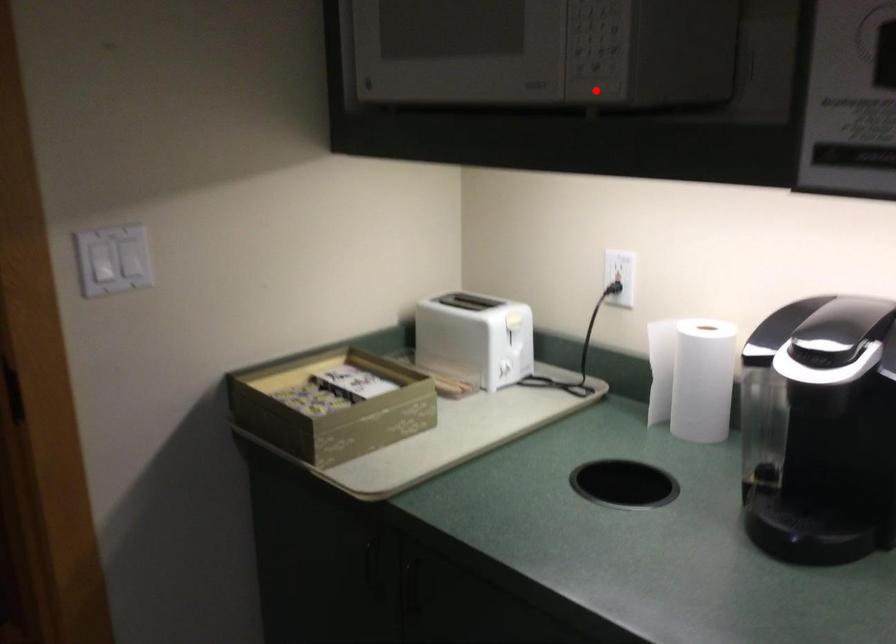
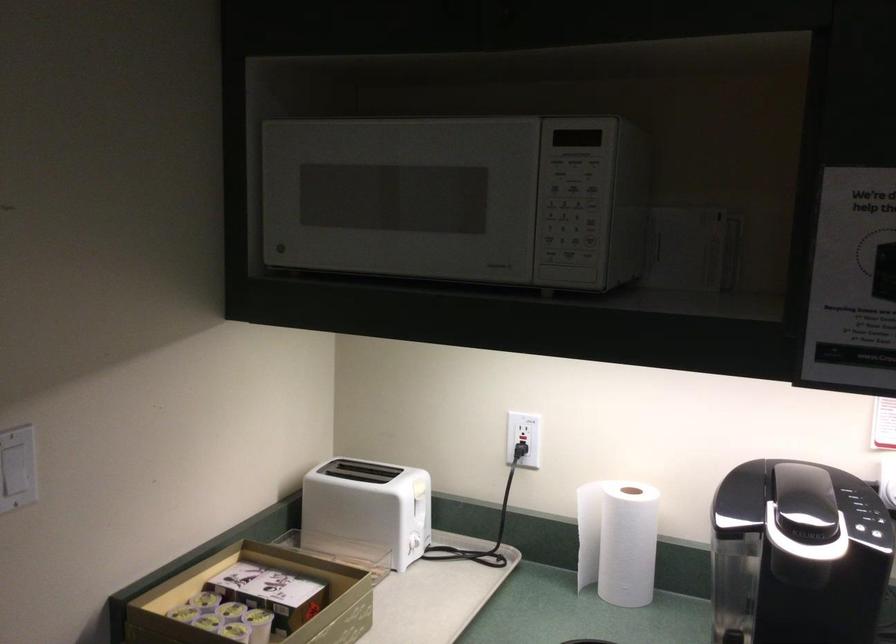
Find the pixel in the second image that matches the highlighted location in the first image.

(565, 279)